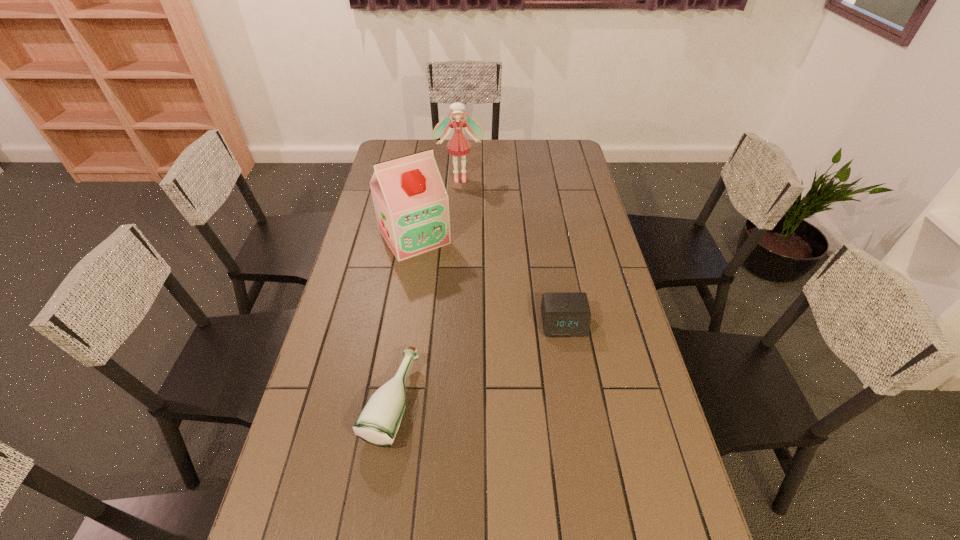
This screenshot has width=960, height=540. I want to click on vacant space at the far left corner of the desktop, so click(x=413, y=150).

Find the location of `blank region between the nearest object and the soya milk`. blank region between the nearest object and the soya milk is located at coordinates (402, 319).

Where is `free space between the bottle and the soya milk`? The image size is (960, 540). free space between the bottle and the soya milk is located at coordinates (402, 319).

This screenshot has height=540, width=960. In order to click on free space that is in between the bottle and the soya milk in this screenshot , I will do `click(402, 319)`.

Find the location of `vacant space in between the rightmost object and the farthest object`. vacant space in between the rightmost object and the farthest object is located at coordinates (512, 251).

At what (x,y) coordinates should I click in order to perform the action: click on vacant space in between the second farthest object and the second nearest object. Please return your answer as a coordinate pair (x, y). Image resolution: width=960 pixels, height=540 pixels. Looking at the image, I should click on (489, 280).

The width and height of the screenshot is (960, 540). What are the coordinates of `unoccupied area between the alarm clock and the doll` in the screenshot? It's located at (512, 251).

You are a GUI agent. You are given a task and a screenshot of the screen. Output one action in this format:
    pyautogui.click(x=<x>, y=<y>)
    Task: Click on the free space between the doll and the alarm clock
    
    Given the screenshot: What is the action you would take?
    pyautogui.click(x=512, y=251)

This screenshot has width=960, height=540. I want to click on empty location between the nearest object and the rightmost object, so click(x=477, y=363).

Image resolution: width=960 pixels, height=540 pixels. What are the coordinates of `vacant area between the bottle and the doll` in the screenshot? It's located at (425, 290).